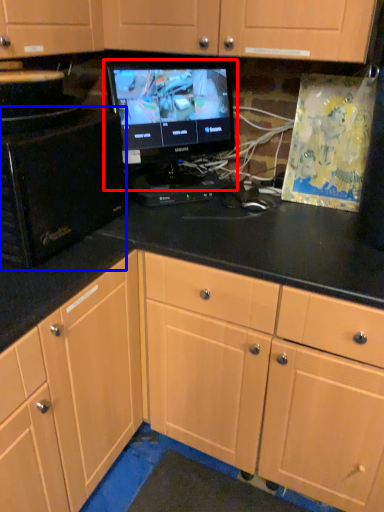
Question: Which object is further to the camera taking this photo, computer monitor (highlighted by a red box) or desktop computer (highlighted by a blue box)?

Choices:
 (A) computer monitor
 (B) desktop computer

Answer: (A)